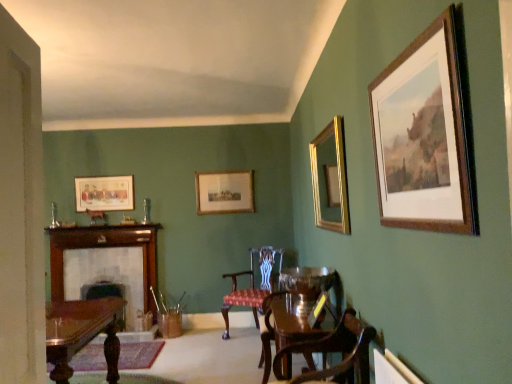
Question: From the image's perspective, is wooden fireplace at left on matte wooden picture frame at upper left, marked as the 2th picture frame in a back-to-front arrangement?

Choices:
 (A) no
 (B) yes

Answer: (A)

Question: Considering the relative positions of wooden fireplace at left and matte wooden picture frame at upper left, which is counted as the 3th picture frame, starting from the front, in the image provided, is wooden fireplace at left behind matte wooden picture frame at upper left, which is counted as the 3th picture frame, starting from the front,?

Choices:
 (A) no
 (B) yes

Answer: (A)

Question: Is wooden fireplace at left thinner than matte wooden picture frame at upper left, which is the 4th picture frame in right-to-left order?

Choices:
 (A) yes
 (B) no

Answer: (B)

Question: Is wooden fireplace at left aimed at matte wooden picture frame at upper left, which is counted as the 3th picture frame, starting from the front?

Choices:
 (A) yes
 (B) no

Answer: (B)

Question: Considering the relative sizes of wooden fireplace at left and matte wooden picture frame at upper left, which is counted as the 3th picture frame, starting from the front, in the image provided, is wooden fireplace at left shorter than matte wooden picture frame at upper left, which is counted as the 3th picture frame, starting from the front,?

Choices:
 (A) no
 (B) yes

Answer: (A)

Question: From the image's perspective, is gold/gilded mirror at upper right, positioned as the third picture frame in left-to-right order, above or below wooden picture frame at upper right, the first picture frame when ordered from right to left?

Choices:
 (A) below
 (B) above

Answer: (A)

Question: Does point (316, 170) appear closer or farther from the camera than point (453, 180)?

Choices:
 (A) farther
 (B) closer

Answer: (A)

Question: Is gold/gilded mirror at upper right, positioned as the third picture frame in left-to-right order, inside or outside of wooden picture frame at upper right, marked as the fourth picture frame in a left-to-right arrangement?

Choices:
 (A) outside
 (B) inside

Answer: (A)

Question: Based on their sizes in the image, would you say gold/gilded mirror at upper right, the 3th picture frame when ordered from back to front, is bigger or smaller than wooden picture frame at upper right, marked as the fourth picture frame in a left-to-right arrangement?

Choices:
 (A) small
 (B) big

Answer: (B)

Question: Considering the positions of wooden picture frame at center, the 2th picture frame from the left, and gold/gilded mirror at upper right, the 3th picture frame when ordered from back to front, in the image, is wooden picture frame at center, the 2th picture frame from the left, bigger or smaller than gold/gilded mirror at upper right, the 3th picture frame when ordered from back to front,?

Choices:
 (A) big
 (B) small

Answer: (B)

Question: Is wooden picture frame at center, the 2th picture frame from the left, inside the boundaries of gold/gilded mirror at upper right, the second picture frame in the right-to-left sequence, or outside?

Choices:
 (A) inside
 (B) outside

Answer: (B)

Question: Is point (238, 200) positioned closer to the camera than point (318, 185)?

Choices:
 (A) farther
 (B) closer

Answer: (A)

Question: From the image's perspective, is wooden picture frame at center, the 2th picture frame from the left, above or below gold/gilded mirror at upper right, the 3th picture frame when ordered from back to front?

Choices:
 (A) below
 (B) above

Answer: (A)

Question: From their relative heights in the image, would you say velvet upholstered chair at center, which is the 1th chair in back-to-front order, is taller or shorter than wooden picture frame at center, acting as the 1th picture frame starting from the back?

Choices:
 (A) short
 (B) tall

Answer: (B)

Question: From the image's perspective, relative to wooden picture frame at center, the 3th picture frame from the right, is velvet upholstered chair at center, positioned as the 3th chair in front-to-back order, above or below?

Choices:
 (A) below
 (B) above

Answer: (A)